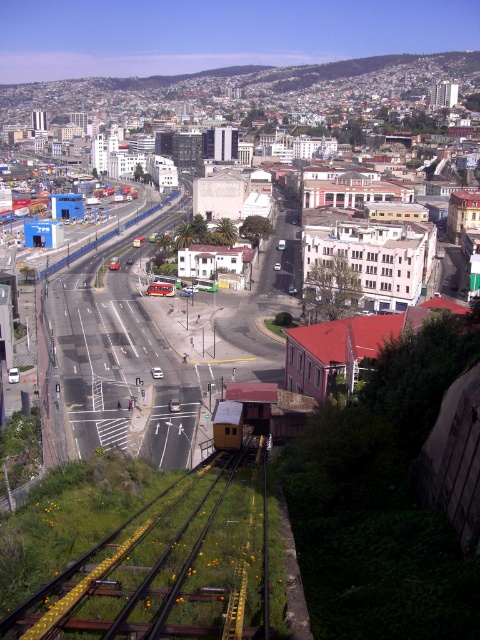
In the scene shown: You are standing at the point marked by point (156, 564) in the image. What object is directly under your feet?

The yellow metal train track at lower center is directly under your feet at point (156, 564).

From the picture: You are a pedestrian standing at the intersection and want to cross the road to the grassy area with flowers. The yellow metal train track at lower center and the yellow metallic train at center are in your path. Which object should you avoid first to safely reach the grassy area?

You should avoid the yellow metallic train at center first because the yellow metal train track at lower center is positioned on the right side of it, meaning the train is closer to your current position at the intersection.

You are a city planner analyzing the layout of this urban area. You notice the yellow metal train track at lower center and the yellow metallic train at center. Which of these two objects is larger in size according to the scene?

The yellow metal train track at lower center is bigger than the yellow metallic train at center according to the scene description.